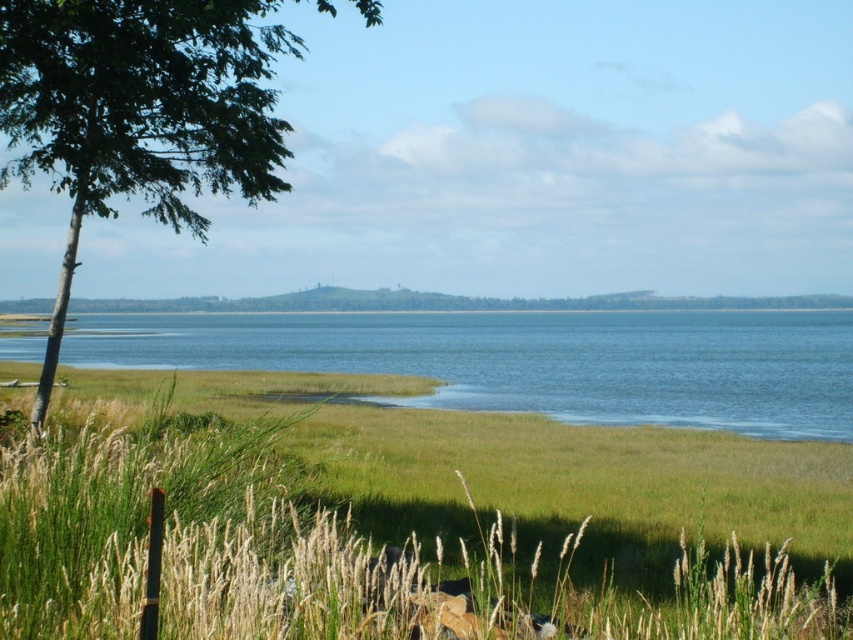
Question: Which object is positioned closest to the green leafy tree at left?

Choices:
 (A) blue water at center
 (B) green grassy at lower center

Answer: (B)

Question: In this image, where is green grassy at lower center located relative to blue water at center?

Choices:
 (A) left
 (B) right

Answer: (B)

Question: Is green grassy at lower center closer to camera compared to green leafy tree at left?

Choices:
 (A) no
 (B) yes

Answer: (B)

Question: Is blue water at center smaller than green leafy tree at left?

Choices:
 (A) yes
 (B) no

Answer: (A)

Question: Which of the following is the closest to the observer?

Choices:
 (A) green leafy tree at left
 (B) green grassy at lower center

Answer: (B)

Question: Which point is farther from the camera taking this photo?

Choices:
 (A) (846, 614)
 (B) (28, 120)
 (C) (624, 369)

Answer: (C)